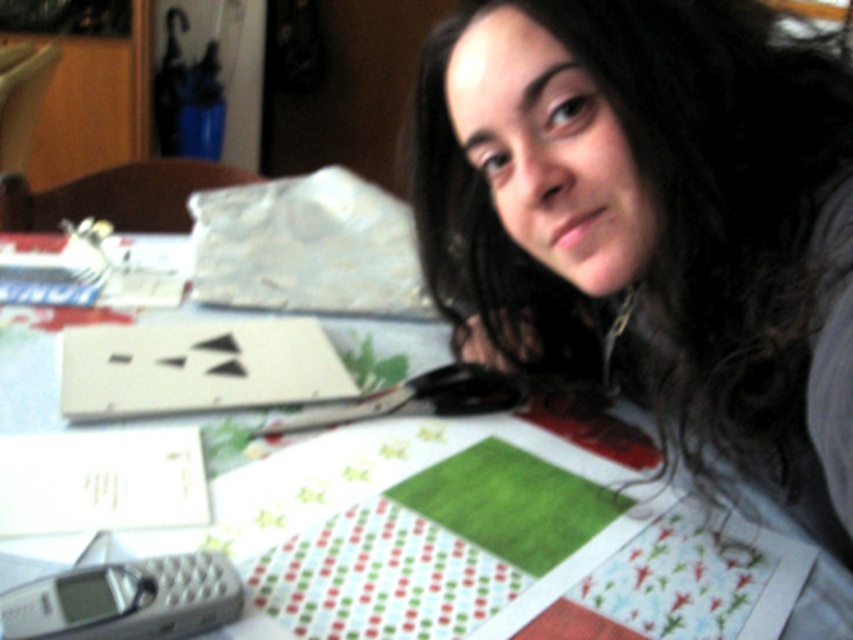
Question: Which is farther from the gray quilted phone at lower left?

Choices:
 (A) green felt at center
 (B) matte black hair at upper center

Answer: (B)

Question: Which object is the farthest from the green felt at center?

Choices:
 (A) gray quilted phone at lower left
 (B) matte black hair at upper center

Answer: (B)

Question: Considering the real-world distances, which object is closest to the gray quilted phone at lower left?

Choices:
 (A) green felt at center
 (B) matte black hair at upper center

Answer: (A)

Question: Does gray quilted phone at lower left appear over green felt at center?

Choices:
 (A) yes
 (B) no

Answer: (B)

Question: Can you confirm if gray quilted phone at lower left is bigger than green felt at center?

Choices:
 (A) no
 (B) yes

Answer: (A)

Question: Is gray quilted phone at lower left positioned in front of green felt at center?

Choices:
 (A) yes
 (B) no

Answer: (A)